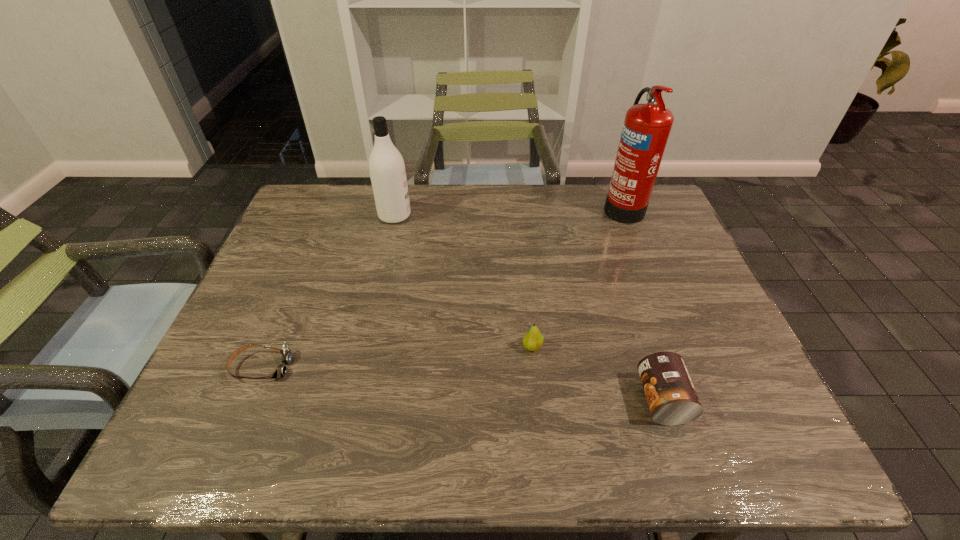
Identify the location of free point located 0.090m on the front-facing side of the second tallest object. Image resolution: width=960 pixels, height=540 pixels. (440, 215).

Image resolution: width=960 pixels, height=540 pixels. Find the location of `vacant space located 0.160m on the right of the pear`. vacant space located 0.160m on the right of the pear is located at coordinates (612, 347).

Identify the location of vacant region located on the front label of the can. This screenshot has height=540, width=960. (596, 400).

Locate an element on the screen. The height and width of the screenshot is (540, 960). vacant space located 0.210m on the front label of the can is located at coordinates (539, 400).

The image size is (960, 540). In order to click on vacant area situated on the front label of the can in this screenshot , I will do `click(591, 400)`.

Identify the location of vacant region located on the front-facing side of the leftmost object. The height and width of the screenshot is (540, 960). (329, 367).

Identify the location of fire extinguisher that is at the far edge. Image resolution: width=960 pixels, height=540 pixels. (646, 128).

Image resolution: width=960 pixels, height=540 pixels. I want to click on shampoo present at the far edge, so click(387, 170).

Locate an element on the screen. This screenshot has width=960, height=540. object situated at the near edge is located at coordinates (672, 399).

Find the location of a particular element. object located at the left edge is located at coordinates (281, 370).